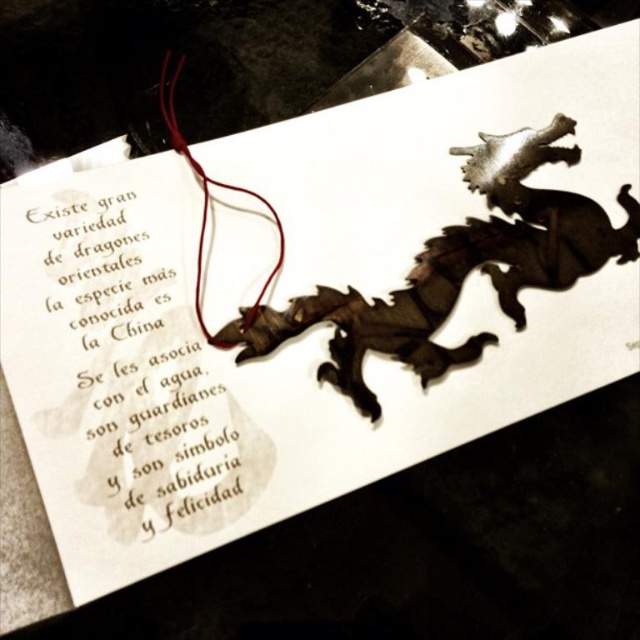
Who is positioned more to the right, gold calligraphy text at upper left or metallic silver dragon at center?

metallic silver dragon at center

Describe the element at coordinates (125, 374) in the screenshot. The height and width of the screenshot is (640, 640). I see `gold calligraphy text at upper left` at that location.

Between point (83, 294) and point (410, 342), which one is positioned behind?

Positioned behind is point (410, 342).

You are a GUI agent. You are given a task and a screenshot of the screen. Output one action in this format:
    pyautogui.click(x=<x>, y=<y>)
    Task: Click on the gold calligraphy text at upper left
    Image resolution: width=640 pixels, height=640 pixels.
    Given the screenshot: What is the action you would take?
    pyautogui.click(x=125, y=374)

Is metallic silver dragon at center smaller than red leather string at upper left?

No.

This screenshot has width=640, height=640. I want to click on metallic silver dragon at center, so click(x=458, y=268).

Between gold calligraphy text at upper left and red leather string at upper left, which one has more height?

red leather string at upper left is taller.

Does point (96, 512) come behind point (172, 132)?

No, it is not.

I want to click on gold calligraphy text at upper left, so pos(125,374).